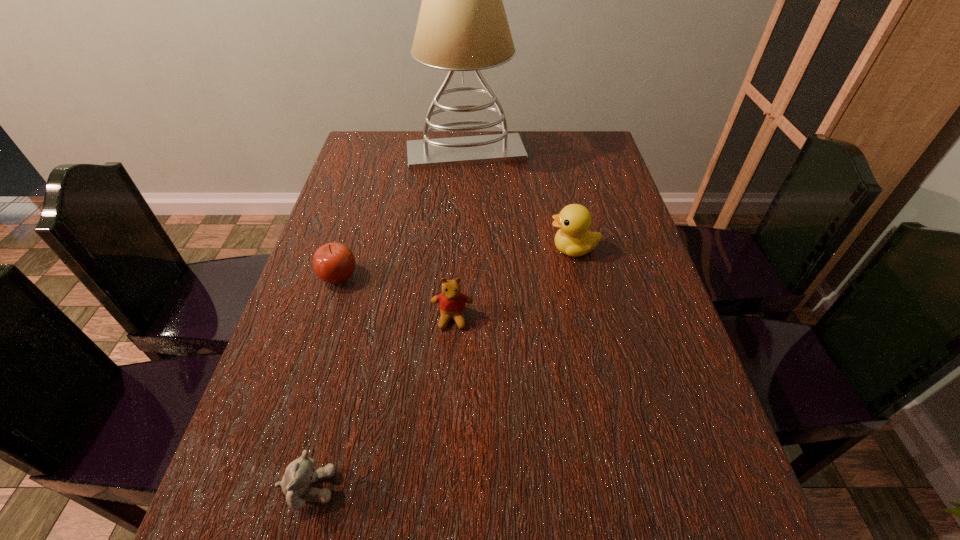
What are the coordinates of `the farthest object` in the screenshot? It's located at (462, 26).

Find the location of a particular element. the tallest object is located at coordinates (462, 26).

Find the location of `the rightmost object`. the rightmost object is located at coordinates click(573, 238).

Locate an element on the screen. Image resolution: width=960 pixels, height=540 pixels. the second tallest object is located at coordinates (573, 238).

This screenshot has height=540, width=960. What are the coordinates of `the taller teddy bear` in the screenshot? It's located at (452, 302).

The width and height of the screenshot is (960, 540). I want to click on the farther teddy bear, so click(452, 302).

This screenshot has width=960, height=540. I want to click on the third farthest object, so click(334, 263).

You are a GUI agent. You are given a task and a screenshot of the screen. Output one action in this format:
    pyautogui.click(x=<x>, y=<y>)
    Task: Click on the shortest object
    
    Given the screenshot: What is the action you would take?
    pyautogui.click(x=300, y=473)

Where is `the nearer teddy bear`? The image size is (960, 540). the nearer teddy bear is located at coordinates (300, 473).

Find the location of a particular element. This screenshot has height=540, width=960. free space located 0.360m on the front of the farthest object is located at coordinates (462, 260).